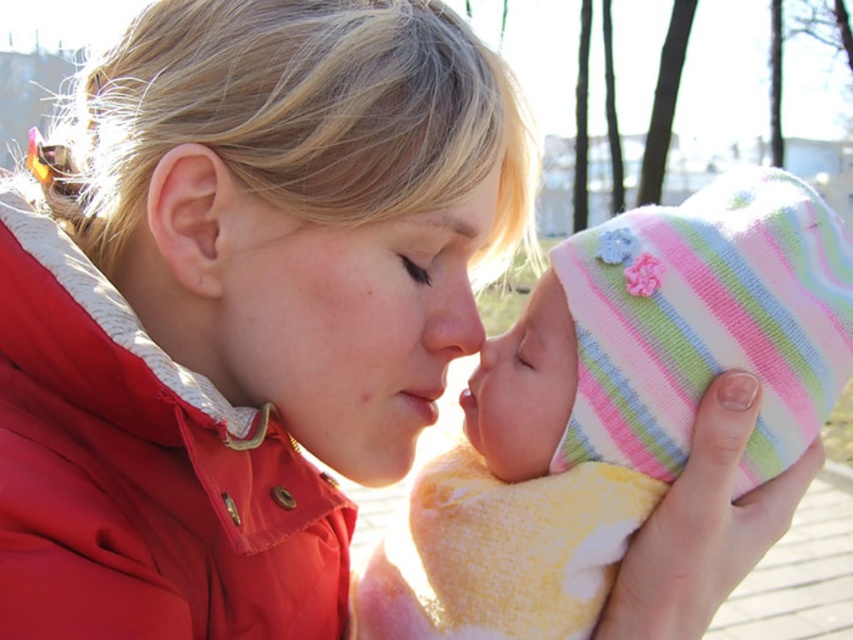
In the scene shown: What are the coordinates of the smooth skin face at center?

The smooth skin face at center is located at point (347, 323).

You are a photographer trying to capture the baby and the woman in the image. You want to ensure that both the smooth skin face at center and the matte skin forehead at upper center are well lit. Since the sunlight is coming from the right side, which part might need additional lighting?

The smooth skin face at center is to the left of the matte skin forehead at upper center. Since the sunlight is coming from the right side, the smooth skin face at center might be in shadow and need additional lighting.

Based on the scene, which object is larger in size between the red quilted jacket at center and the matte skin forehead at upper center?

The red quilted jacket at center is bigger than the matte skin forehead at upper center.